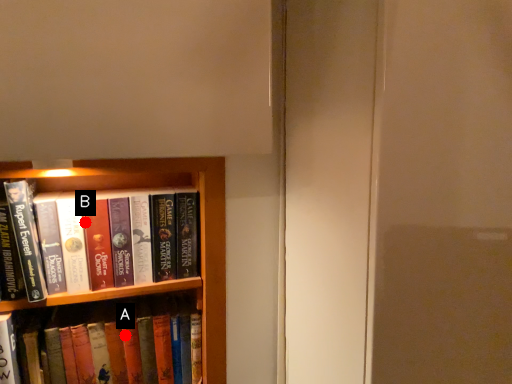
Question: Two points are circled on the image, labeled by A and B beside each circle. Which point is farther from the camera taking this photo?

Choices:
 (A) A is further
 (B) B is further

Answer: (A)